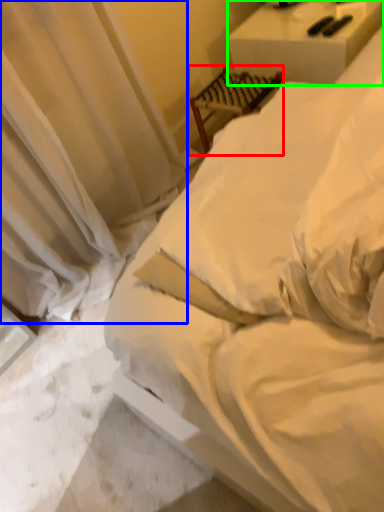
Question: Which object is positioned farthest from furniture (highlighted by a red box)? Select from curtain (highlighted by a blue box) and furniture (highlighted by a green box).

Choices:
 (A) curtain
 (B) furniture

Answer: (A)